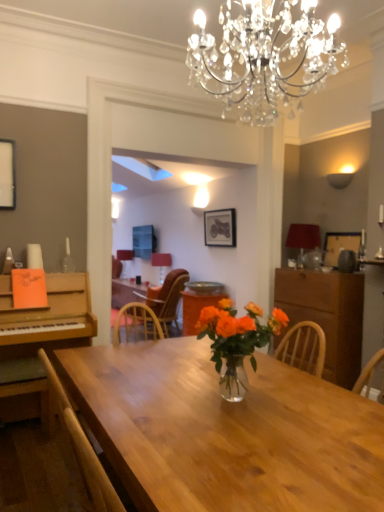
Question: Is matte white lampshade at center, which ranks as the 1th lamp in left-to-right order, taller than matte red lampshade at center, which is the 2th lamp from back to front?

Choices:
 (A) yes
 (B) no

Answer: (A)

Question: From a real-world perspective, is matte white lampshade at center, placed as the second lamp when sorted from right to left, physically below matte red lampshade at center, which is the 2th lamp from back to front?

Choices:
 (A) yes
 (B) no

Answer: (A)

Question: Is matte white lampshade at center, which ranks as the 1th lamp in left-to-right order, to the left of matte red lampshade at center, which appears as the first lamp when viewed from the right, from the viewer's perspective?

Choices:
 (A) no
 (B) yes

Answer: (B)

Question: From a real-world perspective, is matte white lampshade at center, which ranks as the 1th lamp in left-to-right order, over matte red lampshade at center, the 2th lamp in the left-to-right sequence?

Choices:
 (A) yes
 (B) no

Answer: (B)

Question: Considering the relative sizes of matte white lampshade at center, acting as the first lamp starting from the back, and matte red lampshade at center, which appears as the first lamp when viewed from the right, in the image provided, is matte white lampshade at center, acting as the first lamp starting from the back, thinner than matte red lampshade at center, which appears as the first lamp when viewed from the right,?

Choices:
 (A) yes
 (B) no

Answer: (B)

Question: Relative to translucent glass vase at center, is shiny wood table at center in front or behind?

Choices:
 (A) behind
 (B) front

Answer: (B)

Question: Looking at the image, does shiny wood table at center seem bigger or smaller compared to translucent glass vase at center?

Choices:
 (A) big
 (B) small

Answer: (B)

Question: From a real-world perspective, relative to translucent glass vase at center, is shiny wood table at center vertically above or below?

Choices:
 (A) above
 (B) below

Answer: (A)

Question: Visually, is shiny wood table at center positioned to the left or to the right of translucent glass vase at center?

Choices:
 (A) right
 (B) left

Answer: (B)

Question: Is translucent glass vase at center in front of or behind wooden picture frame at right, acting as the 1th picture frame starting from the bottom, in the image?

Choices:
 (A) front
 (B) behind

Answer: (A)

Question: From their relative heights in the image, would you say translucent glass vase at center is taller or shorter than wooden picture frame at right, the 1th picture frame from the front?

Choices:
 (A) tall
 (B) short

Answer: (A)

Question: From the image's perspective, is translucent glass vase at center above or below wooden picture frame at right, acting as the 1th picture frame starting from the bottom?

Choices:
 (A) below
 (B) above

Answer: (A)

Question: Looking at their shapes, would you say translucent glass vase at center is wider or thinner than wooden picture frame at right, which is counted as the second picture frame, starting from the top?

Choices:
 (A) thin
 (B) wide

Answer: (B)

Question: Is transparent glass bottle at left bigger or smaller than wooden chair at lower left, the 2th chair positioned from the back?

Choices:
 (A) big
 (B) small

Answer: (B)

Question: From a real-world perspective, is transparent glass bottle at left physically located above or below wooden chair at lower left, the first chair from the left?

Choices:
 (A) above
 (B) below

Answer: (A)